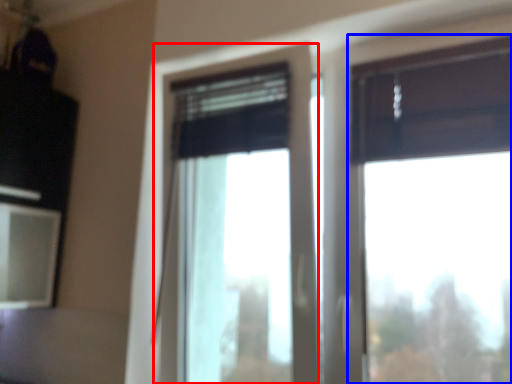
Question: Which of the following is the farthest to the observer, window (highlighted by a red box) or window (highlighted by a blue box)?

Choices:
 (A) window
 (B) window

Answer: (A)